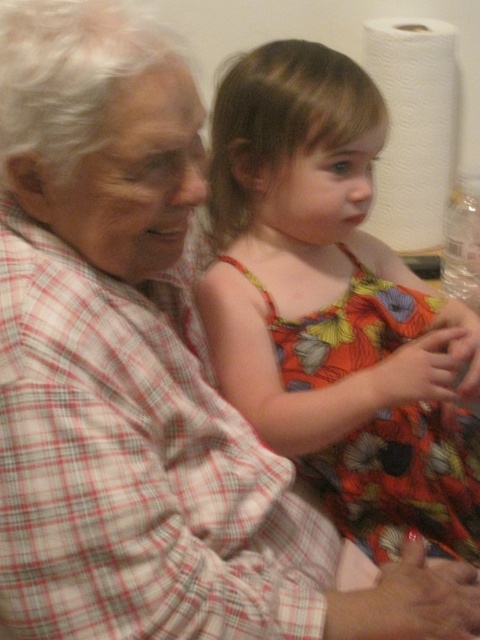
You are a photographer trying to capture a candid shot of the grandmother and granddaughter. You notice the floral fabric dress at center and the white paper towel at upper right. Which object is closer to you, the photographer, when focusing on the scene?

The floral fabric dress at center is closer to you because it is in front of the white paper towel at upper right.

You are organizing a small picnic and need to decide which item can cover more space on the table. Based on the image, which object is wider between the floral fabric dress at center and the white paper towel at upper right?

The floral fabric dress at center is wider than the white paper towel at upper right, so it can cover more space on the table.

You are a delivery robot with a height of 1.2 meters. You need to place a gift box at point (424,410) in the image. Can you safely reach that point without hitting your head?

The distance between the camera and point (424,410) is 1.01 meters. Since the robot is 1.2 meters tall, it would hit its head if it goes there. Choose another location.